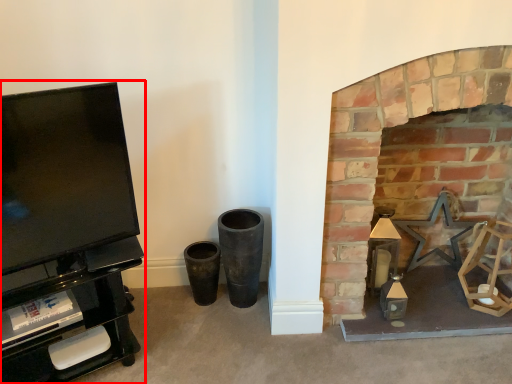
Question: From the image's perspective, what is the correct spatial positioning of entertainment center (annotated by the red box) in reference to fireplace?

Choices:
 (A) above
 (B) below

Answer: (B)